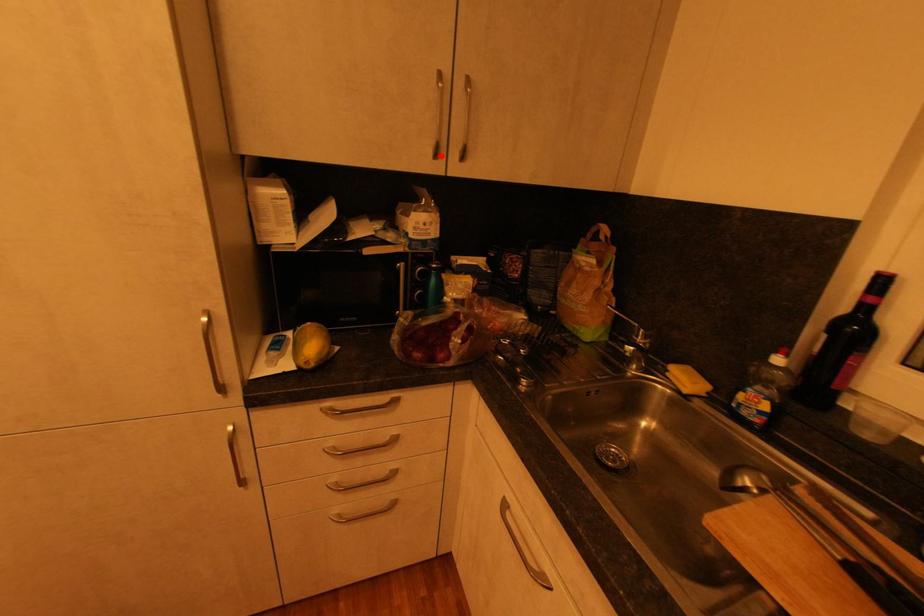
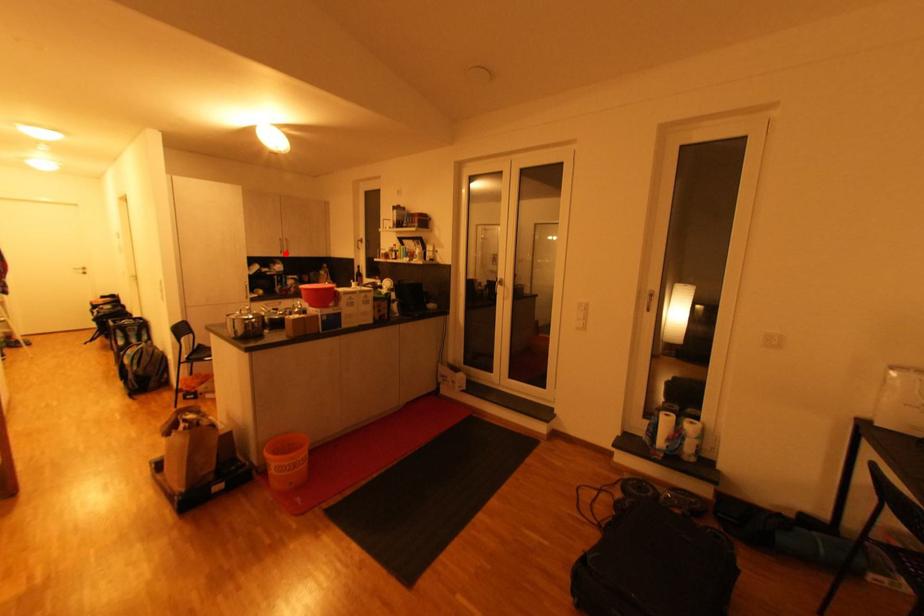
I am providing you with two images of the same scene from different viewpoints. A red point is marked on the first image and another point is marked on the second image. Do the highlighted points in image1 and image2 indicate the same real-world spot?

Yes